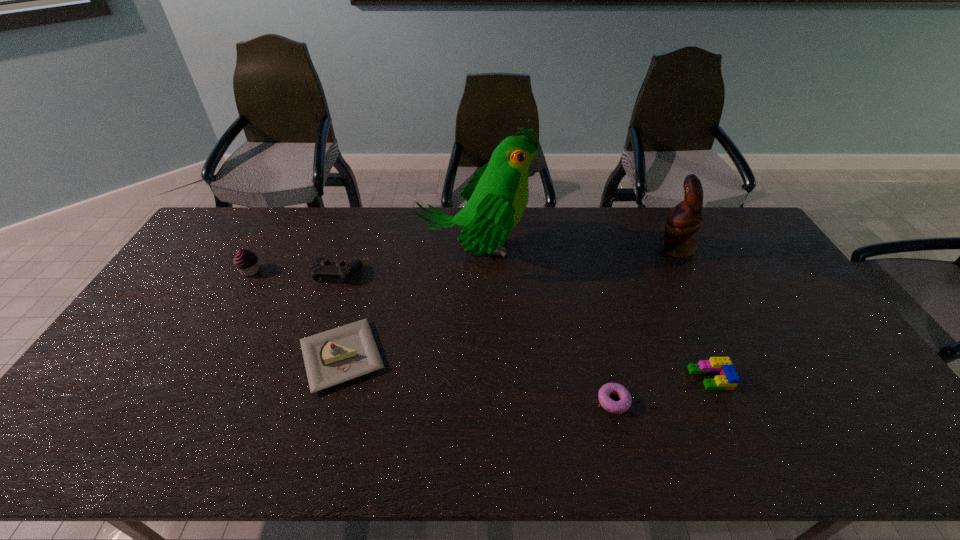
The height and width of the screenshot is (540, 960). What are the coordinates of `empty location between the cake and the fifth object from left to right` in the screenshot? It's located at (477, 379).

You are a GUI agent. You are given a task and a screenshot of the screen. Output one action in this format:
    pyautogui.click(x=<x>, y=<y>)
    Task: Click on the unoccupied position between the Lego and the cake
    
    Given the screenshot: What is the action you would take?
    pyautogui.click(x=526, y=367)

Find the location of a particular element. This screenshot has width=960, height=540. vacant area that lies between the second tallest object and the doughnut is located at coordinates (644, 325).

The image size is (960, 540). Find the location of `free spot between the fourth object from right to left and the sixth shortest object`. free spot between the fourth object from right to left and the sixth shortest object is located at coordinates point(576,249).

Where is `vacant area that lies between the cake and the third tallest object`? This screenshot has width=960, height=540. vacant area that lies between the cake and the third tallest object is located at coordinates (296, 314).

I want to click on object that is the closest to the shortest object, so click(727, 379).

This screenshot has width=960, height=540. Find the location of `object that ranks as the third closest to the cake`. object that ranks as the third closest to the cake is located at coordinates (246, 261).

Locate an element on the screen. free region that satisfies the following two spatial constraints: 1. on the beak of the shortest object; 2. on the left side of the fourth object from left to right is located at coordinates (476, 401).

Identify the location of vacant point that satisfies the following two spatial constraints: 1. on the back side of the Lego; 2. on the left side of the fifth object from left to right. (608, 378).

You are a GUI agent. You are given a task and a screenshot of the screen. Output one action in this format:
    pyautogui.click(x=<x>, y=<y>)
    Task: Click on the free spot that satisfies the following two spatial constraints: 1. on the front side of the cupcake; 2. on the right side of the second shortest object
    This screenshot has width=960, height=540.
    Given the screenshot: What is the action you would take?
    pyautogui.click(x=190, y=378)